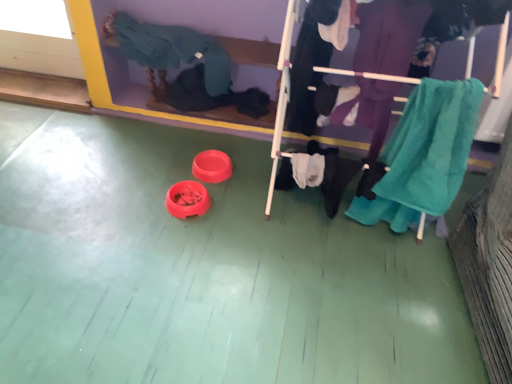
In order to click on free region under teal towel at right, the first clothing positioned from the right (from a real-world perspective) in this screenshot , I will do `click(388, 249)`.